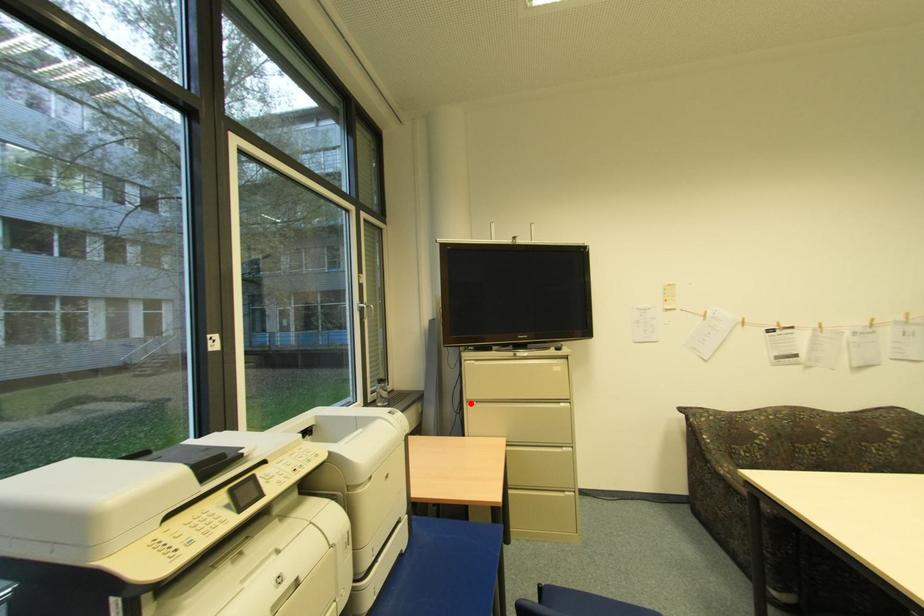
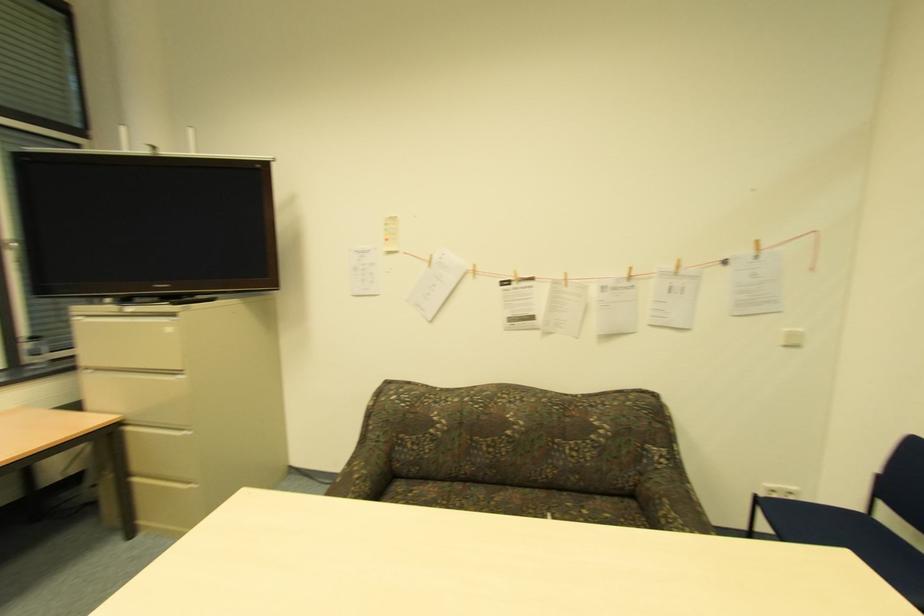
Question: I am providing you with two images of the same scene from different viewpoints. In image1, a red point is highlighted. Considering the same 3D point in image2, which of the following is correct?

Choices:
 (A) It is closer
 (B) It is farther

Answer: (A)